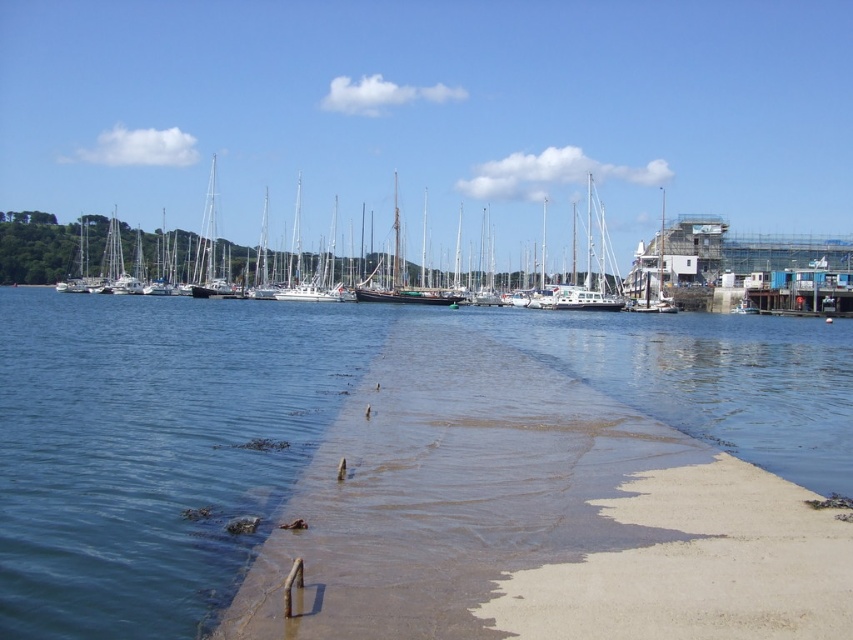
Question: Estimate the real-world distances between objects in this image. Which object is farther from the clear water at lower left?

Choices:
 (A) sandy concrete at center
 (B) wooden sailboat at center

Answer: (B)

Question: Is sandy concrete at center smaller than clear water at lower left?

Choices:
 (A) yes
 (B) no

Answer: (A)

Question: Is sandy concrete at center to the right of clear water at lower left from the viewer's perspective?

Choices:
 (A) no
 (B) yes

Answer: (B)

Question: Which object is positioned farthest from the sandy concrete at center?

Choices:
 (A) clear water at lower left
 (B) wooden sailboat at center

Answer: (B)

Question: Does sandy concrete at center appear on the right side of clear water at lower left?

Choices:
 (A) yes
 (B) no

Answer: (A)

Question: Among these points, which one is farthest from the camera?

Choices:
 (A) (578, 564)
 (B) (77, 301)
 (C) (190, 269)

Answer: (C)